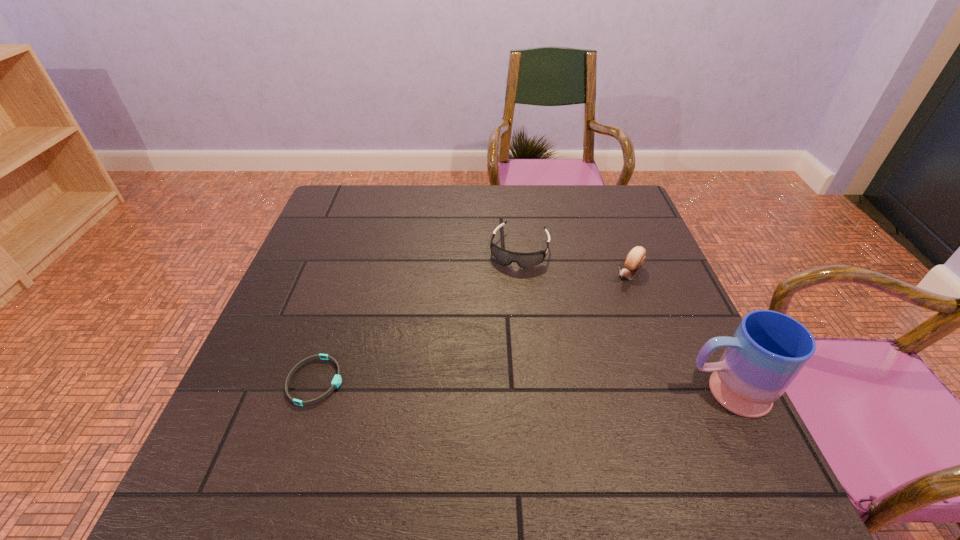
You are a GUI agent. You are given a task and a screenshot of the screen. Output one action in this format:
    pyautogui.click(x=<x>, y=<y>)
    Task: Click on the wristband
    This screenshot has width=960, height=540.
    Given the screenshot: What is the action you would take?
    pyautogui.click(x=337, y=379)

This screenshot has height=540, width=960. What are the coordinates of `the leftmost object` in the screenshot? It's located at (337, 379).

Locate an element on the screen. mug is located at coordinates (768, 350).

Identify the location of escargot. This screenshot has width=960, height=540. (635, 259).

Locate an element on the screen. This screenshot has width=960, height=540. the second shortest object is located at coordinates (524, 260).

I want to click on goggles, so click(x=524, y=260).

At what (x,y) coordinates should I click in order to perform the action: click on vacant space located on the buckle of the leftmost object. Please return your answer as a coordinate pair (x, y). The image size is (960, 540). Looking at the image, I should click on (463, 381).

You are a GUI agent. You are given a task and a screenshot of the screen. Output one action in this format:
    pyautogui.click(x=<x>, y=<y>)
    Task: Click on the vacant space positioned on the side of the tallest object with the handle
    
    Given the screenshot: What is the action you would take?
    pyautogui.click(x=554, y=392)

Locate an element on the screen. The image size is (960, 540). free spot located 0.350m on the side of the tallest object with the handle is located at coordinates (509, 392).

Find the location of a particular element. vacant space located 0.300m on the side of the tallest object with the handle is located at coordinates (534, 392).